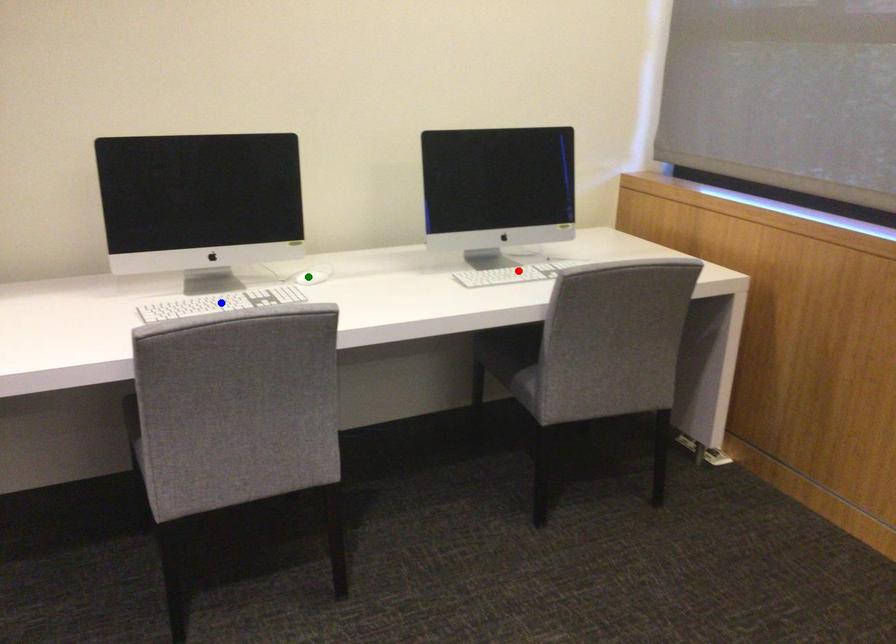
Order these from nearest to farthest:
red point, blue point, green point

1. blue point
2. green point
3. red point